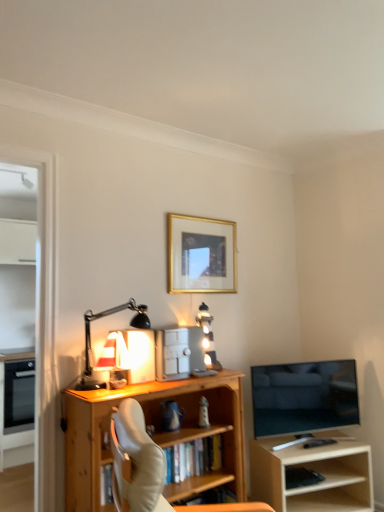
Question: Relative to black matte keyboard at lower right, is light wood shelf at right in front or behind?

Choices:
 (A) front
 (B) behind

Answer: (A)

Question: Is light wood shelf at right to the left or to the right of black matte keyboard at lower right in the image?

Choices:
 (A) left
 (B) right

Answer: (B)

Question: Which object is the farthest from the matte black oven at left, which appears as the 2th appliance when viewed from the top?

Choices:
 (A) gold-framed picture at upper center
 (B) flat screen tv at right
 (C) transparent glass door at left
 (D) wooden bookcase at center
 (E) black matte desk lamp at left

Answer: (B)

Question: Which object is positioned closest to the light wood shelf at right?

Choices:
 (A) wooden bookcase at center
 (B) gold-framed picture at upper center
 (C) flat screen tv at right
 (D) metallic silver safe at center, arranged as the 2th appliance when viewed from the back
 (E) transparent glass door at left

Answer: (C)